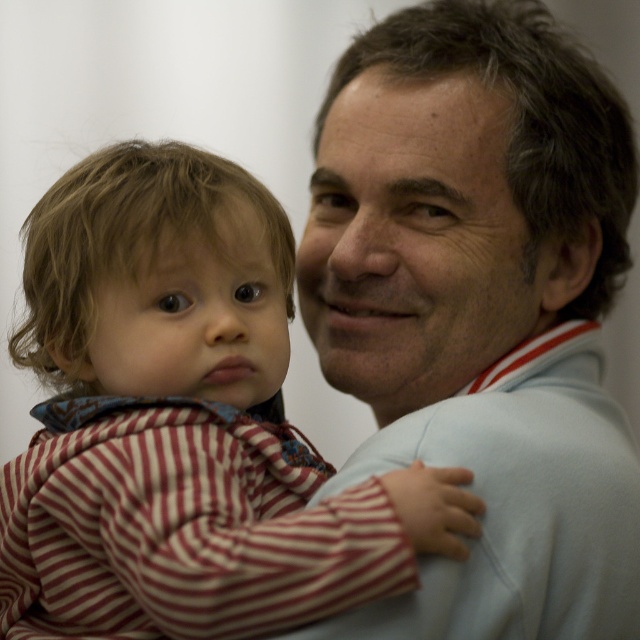
Question: Can you confirm if light blue sweater at upper right is positioned above striped cotton onesie at left?

Choices:
 (A) yes
 (B) no

Answer: (A)

Question: Among these objects, which one is farthest from the camera?

Choices:
 (A) striped cotton onesie at left
 (B) light blue sweater at upper right

Answer: (B)

Question: Is light blue sweater at upper right below striped cotton onesie at left?

Choices:
 (A) no
 (B) yes

Answer: (A)

Question: Is light blue sweater at upper right bigger than striped cotton onesie at left?

Choices:
 (A) no
 (B) yes

Answer: (B)

Question: Which point is farther from the camera taking this photo?

Choices:
 (A) (35, 337)
 (B) (596, 150)

Answer: (B)